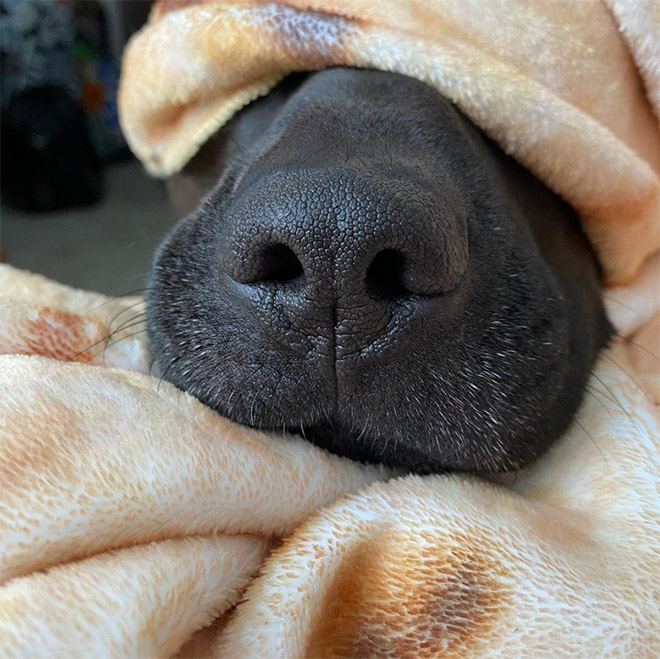
Identify the location of floor. The height and width of the screenshot is (659, 660). (44, 248).